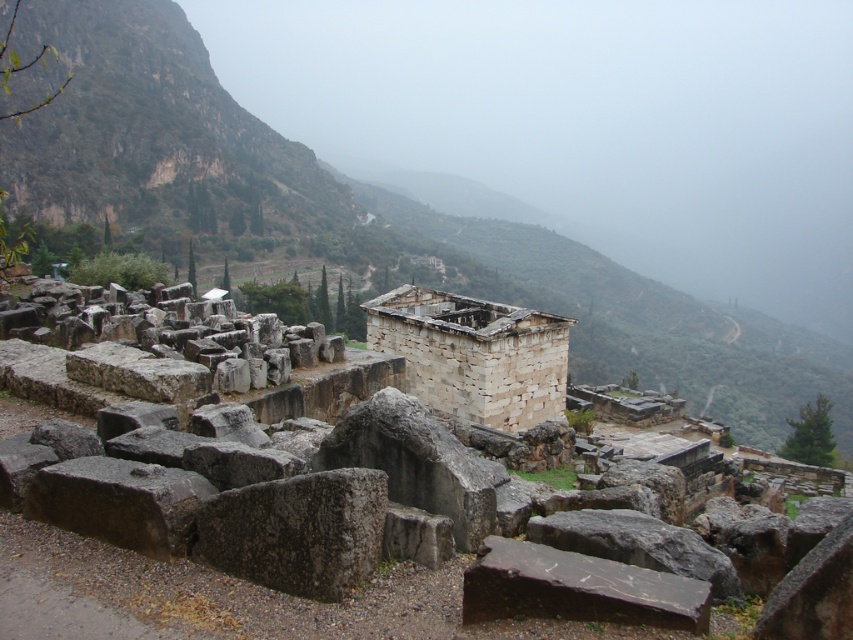
You are an archaeologist exploring the ancient site. You notice two structures in the image. Which one is positioned to the left of the other? The gray stone wall at center and the white stone building at center.

The gray stone wall at center is to the left of the white stone building at center.